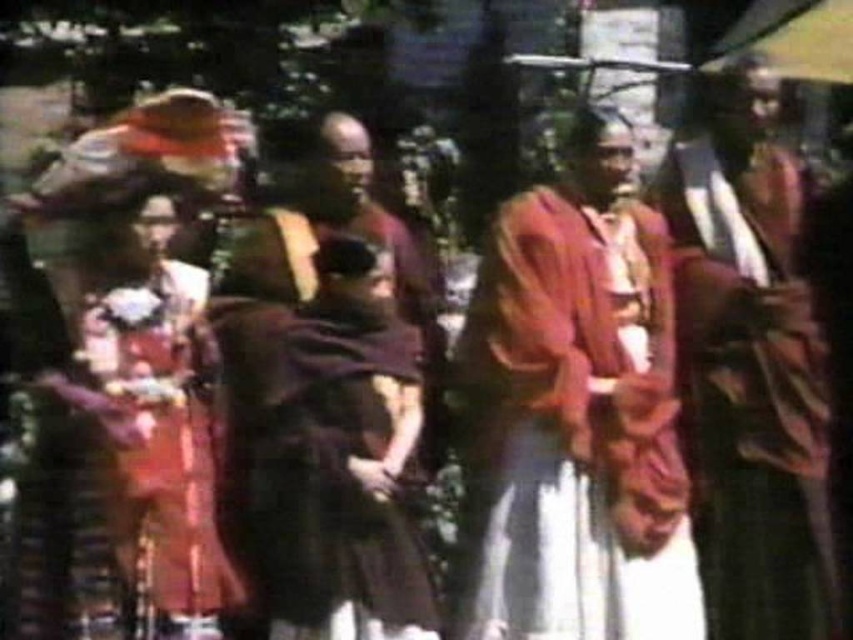
You are a tailor measuring garments for a costume fitting. You have a dark brown robe at center and a matte orange dress at left. Which garment has a greater width according to the image?

The dark brown robe at center has a greater width than the matte orange dress at left as stated in the description.

You are a photographer trying to capture a clear shot of the dark brown robe at center and the silky maroon robe at center. Since the image is blurry, which robe should you focus on first to ensure it appears sharp in the photo?

The dark brown robe at center is closer to the viewer than the silky maroon robe at center, so focusing on the dark brown robe at center first will ensure it appears sharp in the photo.

You are a costume designer preparing for a historical drama. You have two robes available for the main character. The dark brown robe at center and the silky maroon robe at center. Which robe should you choose if you want the robe to reach below the knees?

The silky maroon robe at center is longer than the dark brown robe at center, so you should choose the silky maroon robe at center if you want the robe to reach below the knees.